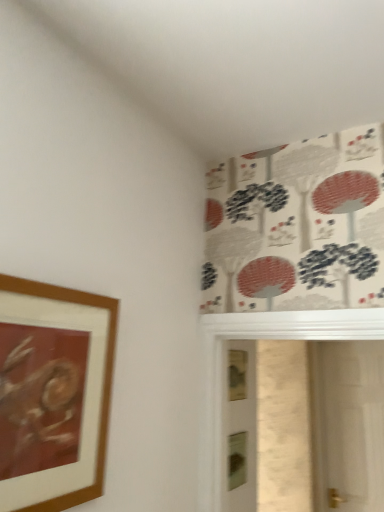
Question: Does transparent glass screen door at right appear on the left side of wooden picture frame at left?

Choices:
 (A) no
 (B) yes

Answer: (A)

Question: Would you say wooden picture frame at left is part of transparent glass screen door at right's contents?

Choices:
 (A) no
 (B) yes

Answer: (A)

Question: Are transparent glass screen door at right and wooden picture frame at left far apart?

Choices:
 (A) no
 (B) yes

Answer: (B)

Question: Is transparent glass screen door at right behind wooden picture frame at left?

Choices:
 (A) yes
 (B) no

Answer: (A)

Question: Considering the relative positions of transparent glass screen door at right and wooden picture frame at left in the image provided, is transparent glass screen door at right to the right of wooden picture frame at left from the viewer's perspective?

Choices:
 (A) yes
 (B) no

Answer: (A)

Question: Are transparent glass screen door at right and wooden picture frame at left making contact?

Choices:
 (A) no
 (B) yes

Answer: (A)

Question: Is wooden picture frame at left with transparent glass screen door at right?

Choices:
 (A) no
 (B) yes

Answer: (A)

Question: Is wooden picture frame at left located outside transparent glass screen door at right?

Choices:
 (A) no
 (B) yes

Answer: (B)

Question: Can transparent glass screen door at right be found inside wooden picture frame at left?

Choices:
 (A) no
 (B) yes

Answer: (A)

Question: From a real-world perspective, is wooden picture frame at left over transparent glass screen door at right?

Choices:
 (A) yes
 (B) no

Answer: (A)

Question: Considering the relative sizes of wooden picture frame at left and transparent glass screen door at right in the image provided, is wooden picture frame at left shorter than transparent glass screen door at right?

Choices:
 (A) yes
 (B) no

Answer: (A)

Question: Is wooden picture frame at left wider than transparent glass screen door at right?

Choices:
 (A) no
 (B) yes

Answer: (A)

Question: Visually, is transparent glass screen door at right positioned to the left or to the right of wooden picture frame at left?

Choices:
 (A) left
 (B) right

Answer: (B)